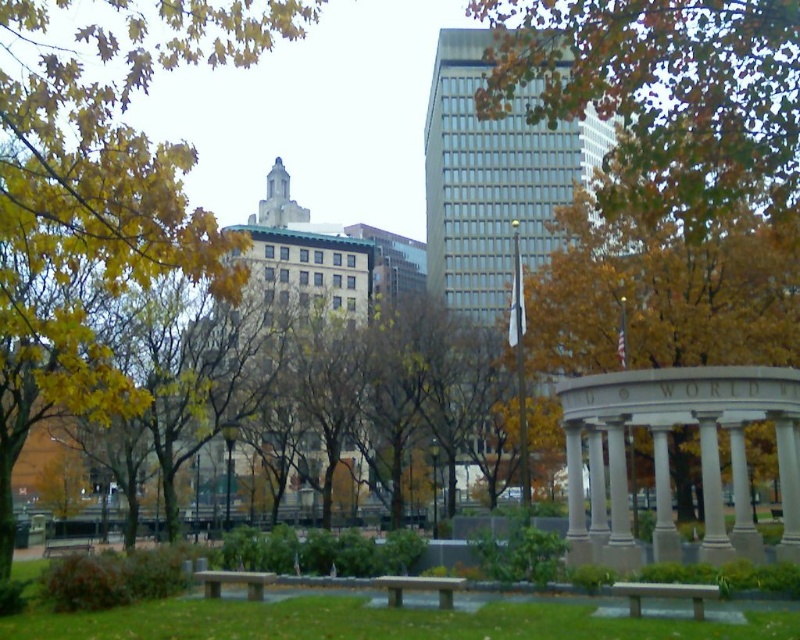
You are a park visitor sitting on the stone bench at center. Looking up, you notice the green leafy tree at upper center. Based on the scene, is the tree positioned higher or lower than the bench?

The green leafy tree at upper center is positioned above the stone bench at center, so it is higher than the bench.

You are a park visitor who wants to take a photo of the yellow leafy tree at upper left from the wooden bench at center. Can you see the entire tree from the bench without any obstruction?

The yellow leafy tree at upper left is taller than the wooden bench at center, so you might not be able to see the entire tree from the bench due to its height unless you move to a higher vantage point.

You are standing in the park and want to take a photo of the yellow leafy tree at upper left. If your camera has a maximum focus range of 15 feet, will you need to move closer to capture it clearly?

The yellow leafy tree at upper left is 18.30 feet away from the camera, which exceeds the maximum focus range of 15 feet. Therefore, you need to move closer to ensure the tree is in focus.